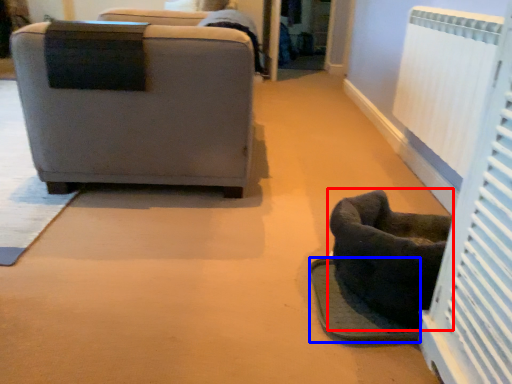
Question: Which of the following is the closest to the observer, furniture (highlighted by a red box) or footrest (highlighted by a blue box)?

Choices:
 (A) furniture
 (B) footrest

Answer: (A)